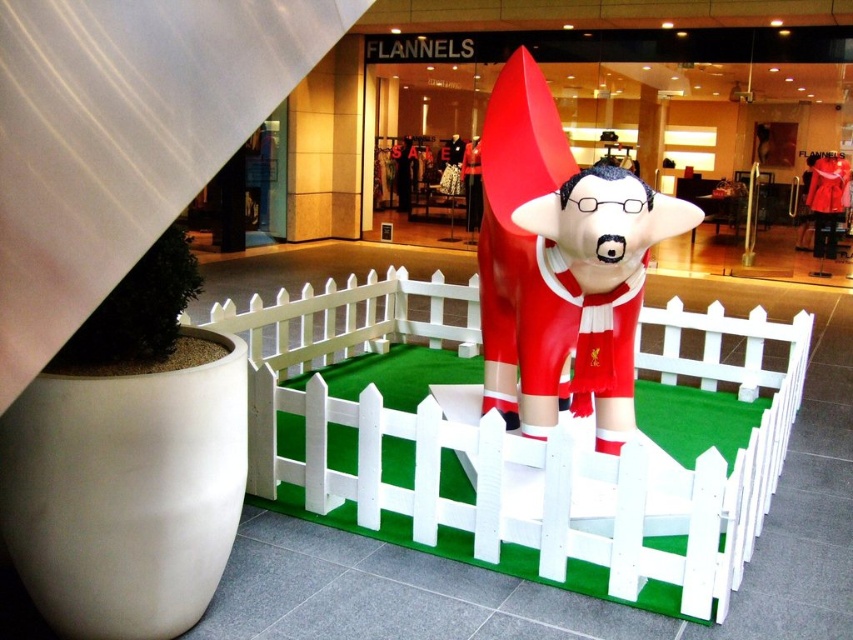
Question: Which of the following is the farthest from the observer?

Choices:
 (A) white plastic fence at center
 (B) shiny red statue at center

Answer: (B)

Question: Does white plastic fence at center have a lesser width compared to shiny red statue at center?

Choices:
 (A) yes
 (B) no

Answer: (B)

Question: Among these objects, which one is nearest to the camera?

Choices:
 (A) shiny red statue at center
 (B) white plastic fence at center

Answer: (B)

Question: Does white plastic fence at center appear on the right side of shiny red statue at center?

Choices:
 (A) yes
 (B) no

Answer: (A)

Question: Is white plastic fence at center to the left of shiny red statue at center from the viewer's perspective?

Choices:
 (A) yes
 (B) no

Answer: (B)

Question: Among these objects, which one is farthest from the camera?

Choices:
 (A) white plastic fence at center
 (B) shiny red statue at center

Answer: (B)